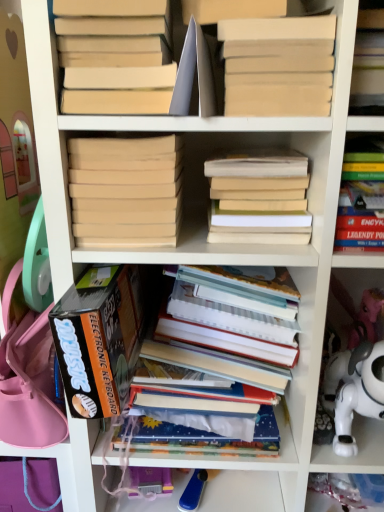
Question: Is matte beige book at upper left, placed as the 3th book when sorted from left to right, aimed at beige matte book at center, which is counted as the 6th book, starting from the right?

Choices:
 (A) no
 (B) yes

Answer: (A)

Question: Is matte beige book at upper left, placed as the 3th book when sorted from left to right, positioned in front of beige matte book at center, which is the second book from left to right?

Choices:
 (A) yes
 (B) no

Answer: (A)

Question: Is matte beige book at upper left, placed as the 3th book when sorted from left to right, to the right of beige matte book at center, which is counted as the 6th book, starting from the right, from the viewer's perspective?

Choices:
 (A) yes
 (B) no

Answer: (A)

Question: Considering the relative positions of matte beige book at upper left, placed as the 3th book when sorted from left to right, and beige matte book at center, which is counted as the 6th book, starting from the right, in the image provided, is matte beige book at upper left, placed as the 3th book when sorted from left to right, behind beige matte book at center, which is counted as the 6th book, starting from the right,?

Choices:
 (A) yes
 (B) no

Answer: (B)

Question: Considering the relative sizes of matte beige book at upper left, which is counted as the 5th book, starting from the right, and beige matte book at center, which is the second book from left to right, in the image provided, is matte beige book at upper left, which is counted as the 5th book, starting from the right, wider than beige matte book at center, which is the second book from left to right,?

Choices:
 (A) yes
 (B) no

Answer: (B)

Question: From the image's perspective, is matte beige book at upper left, which is counted as the 5th book, starting from the right, below beige matte book at center, which is the second book from left to right?

Choices:
 (A) no
 (B) yes

Answer: (A)

Question: Is light brown matte book at center, which is the 6th book from left to right, bigger than hardcover books at center, which is counted as the fourth book, starting from the right?

Choices:
 (A) yes
 (B) no

Answer: (B)

Question: Is light brown matte book at center, which is the 6th book from left to right, positioned behind hardcover books at center, which is counted as the 4th book, starting from the left?

Choices:
 (A) no
 (B) yes

Answer: (A)

Question: Would you say light brown matte book at center, placed as the 2th book when sorted from right to left, contains hardcover books at center, which is counted as the fourth book, starting from the right?

Choices:
 (A) yes
 (B) no

Answer: (B)

Question: Is hardcover books at center, which is counted as the fourth book, starting from the right, at the back of light brown matte book at center, which is the 6th book from left to right?

Choices:
 (A) no
 (B) yes

Answer: (A)

Question: Considering the relative sizes of light brown matte book at center, which is the 6th book from left to right, and hardcover books at center, which is counted as the 4th book, starting from the left, in the image provided, is light brown matte book at center, which is the 6th book from left to right, shorter than hardcover books at center, which is counted as the 4th book, starting from the left,?

Choices:
 (A) no
 (B) yes

Answer: (B)

Question: From the image's perspective, is light brown matte book at center, placed as the 2th book when sorted from right to left, below hardcover books at center, which is counted as the 4th book, starting from the left?

Choices:
 (A) no
 (B) yes

Answer: (A)

Question: From a real-world perspective, is white plastic toy at lower right physically below black cardboard box at lower left, which is the 7th book in right-to-left order?

Choices:
 (A) yes
 (B) no

Answer: (A)